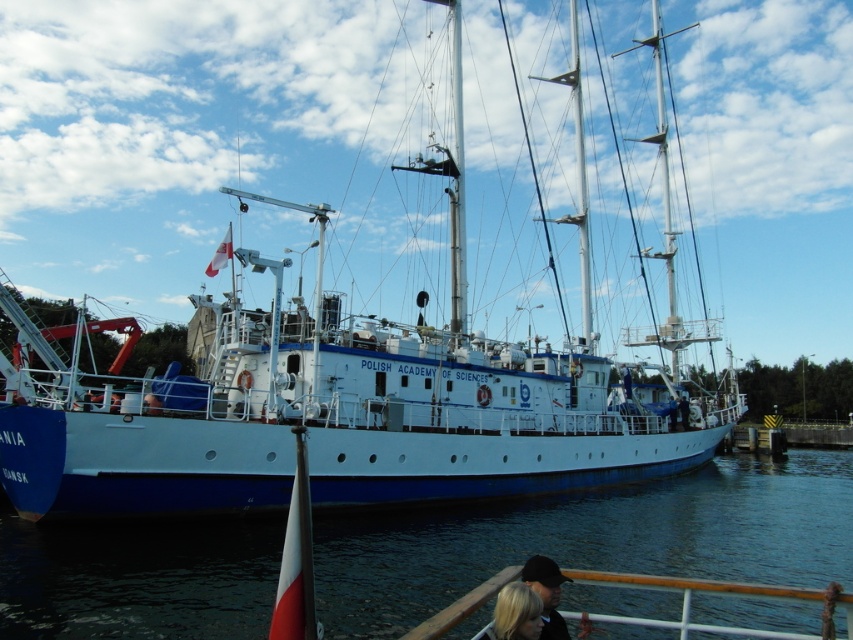
This screenshot has height=640, width=853. What do you see at coordinates (352, 400) in the screenshot?
I see `white matte ship at center` at bounding box center [352, 400].

Can you confirm if white matte ship at center is smaller than dark blue fabric cap at lower center?

Incorrect, white matte ship at center is not smaller in size than dark blue fabric cap at lower center.

Describe the element at coordinates (352, 400) in the screenshot. The width and height of the screenshot is (853, 640). I see `white matte ship at center` at that location.

Identify the location of white matte ship at center. This screenshot has width=853, height=640. (352, 400).

Which of these two, white matte ship at center or blonde hair at lower right, stands taller?

white matte ship at center

The height and width of the screenshot is (640, 853). Identify the location of white matte ship at center. (352, 400).

You are a GUI agent. You are given a task and a screenshot of the screen. Output one action in this format:
    pyautogui.click(x=<x>, y=<y>)
    Task: Click on the white matte ship at center
    The image size is (853, 640).
    Given the screenshot: What is the action you would take?
    pyautogui.click(x=352, y=400)

Which is more to the left, blue water at lower left or blonde hair at lower right?

Positioned to the left is blonde hair at lower right.

Between blue water at lower left and blonde hair at lower right, which one is positioned lower?

Positioned lower is blue water at lower left.

Which is in front, point (321, 552) or point (512, 609)?

Point (512, 609) is more forward.

This screenshot has height=640, width=853. Identify the location of blue water at lower left. (595, 538).